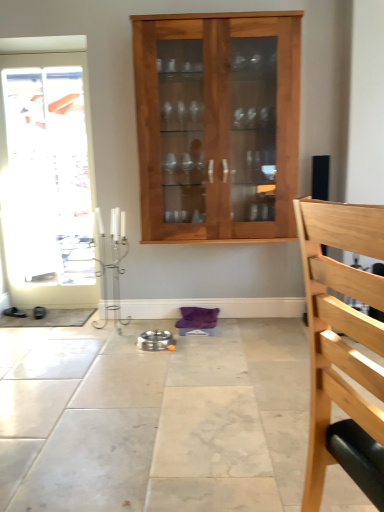
Question: Considering the positions of light brown wood cabinet at center and light wood chair at right in the image, is light brown wood cabinet at center taller or shorter than light wood chair at right?

Choices:
 (A) tall
 (B) short

Answer: (A)

Question: Is light brown wood cabinet at center situated inside light wood chair at right or outside?

Choices:
 (A) inside
 (B) outside

Answer: (B)

Question: Which is nearer to the white glossy door at left?

Choices:
 (A) black leather shoes at lower left
 (B) light brown wood cabinet at center
 (C) light wood chair at right

Answer: (A)

Question: Considering the real-world distances, which object is closest to the white glossy door at left?

Choices:
 (A) light wood chair at right
 (B) black leather shoes at lower left
 (C) light brown wood cabinet at center

Answer: (B)